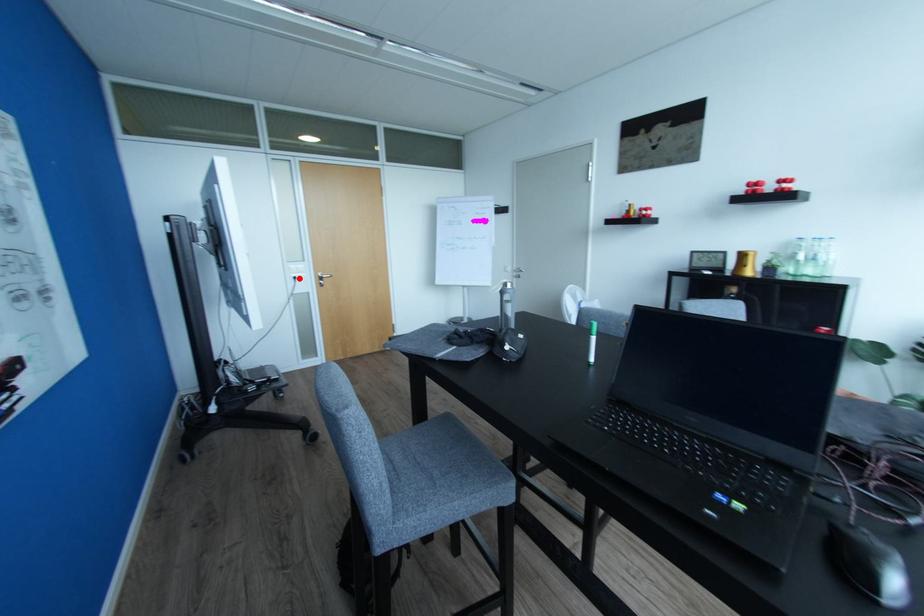
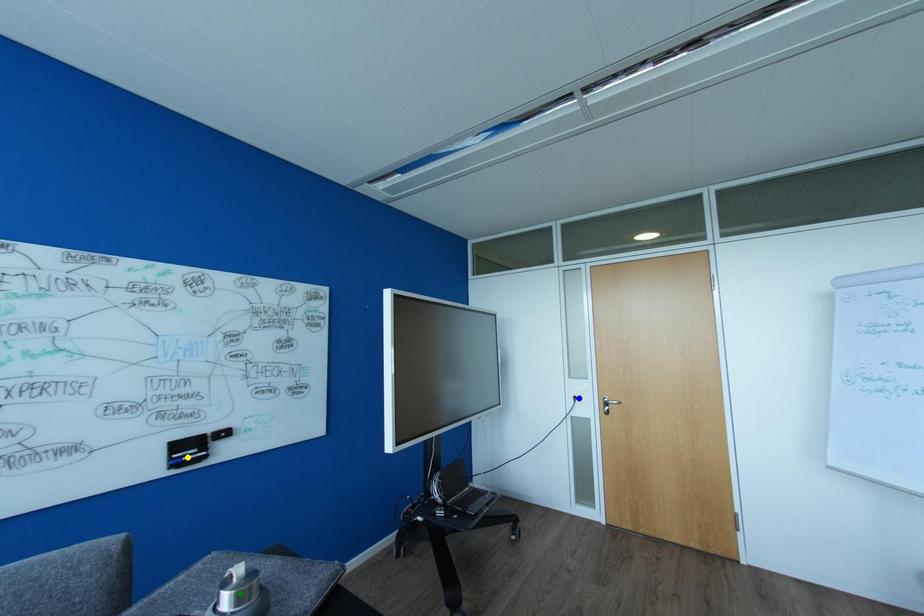
Question: I am providing you with two images of the same scene from different viewpoints. A red point is marked on the first image. You are given multiple points on the second image. Which mark in image 2 goes with the point in image 1?

Choices:
 (A) yellow point
 (B) blue point
 (C) green point

Answer: (B)